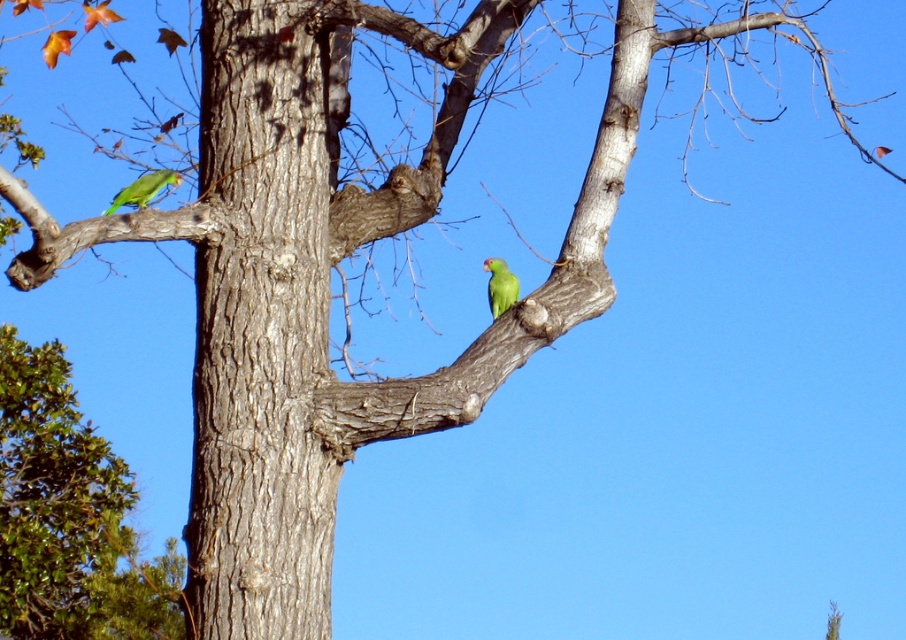
Based on the photo, you are a birdwatcher observing the scene. You notice the smooth bark tree trunk at center and the green matte parrot at left. Which object is taller in this image?

The smooth bark tree trunk at center is taller than the green matte parrot at left according to the description.

You are a birdwatcher observing two green matte parrots in a tree. The parrots are labeled as the green matte parrot at left and the green matte parrot at center. Based on their sizes, which parrot do you think is closer to you?

The green matte parrot at left is larger in size than the green matte parrot at center. In general, objects that are closer appear larger. Therefore, the green matte parrot at left is likely closer to you.

Based on the photo, you are a birdwatcher trying to identify the tree species in the image. The image shows two green parrots on a branch. There is a point marked at coordinates (261, 326). What does this point indicate about the tree trunk?

The point at (261, 326) indicates the location of the smooth bark tree trunk at center.